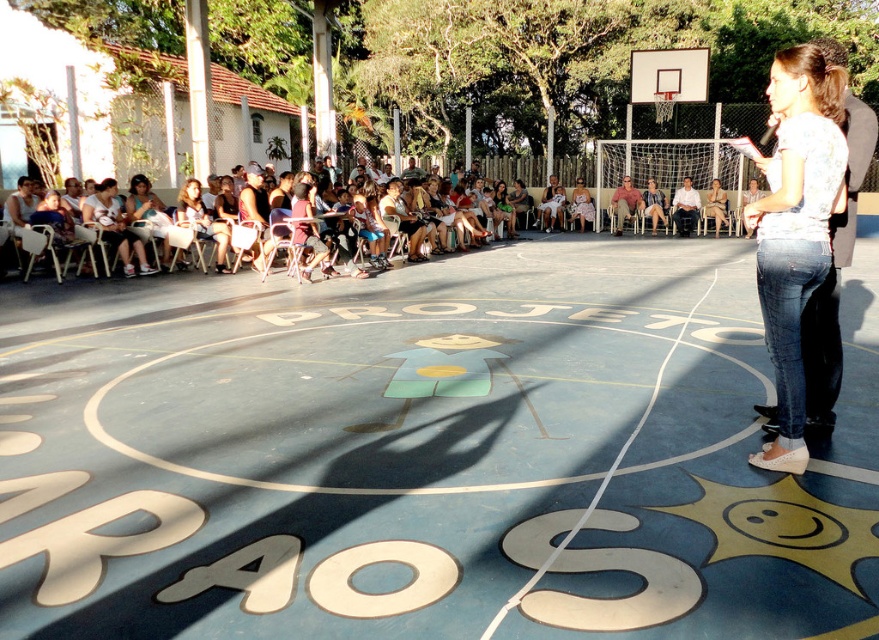
Who is lower down, blue rubber basketball court at center or white printed blouse at center?

blue rubber basketball court at center is below.

Which is behind, point (470, 308) or point (826, 180)?

Point (470, 308)

Is point (640, 353) farther from camera compared to point (798, 310)?

Yes, point (640, 353) is behind point (798, 310).

This screenshot has width=879, height=640. I want to click on blue rubber basketball court at center, so click(x=427, y=452).

Is the position of white printed blouse at center less distant than that of matte pink dress at center?

Yes, it is.

The image size is (879, 640). What do you see at coordinates (796, 227) in the screenshot?
I see `white printed blouse at center` at bounding box center [796, 227].

Locate an element on the screen. white printed blouse at center is located at coordinates (796, 227).

Can you confirm if blue rubber basketball court at center is thinner than metallic silver basketball hoop at upper center?

In fact, blue rubber basketball court at center might be wider than metallic silver basketball hoop at upper center.

Consider the image. Who is more forward, (775, 476) or (634, 72)?

Point (775, 476) is in front.

Identify the location of blue rubber basketball court at center. This screenshot has height=640, width=879. (427, 452).